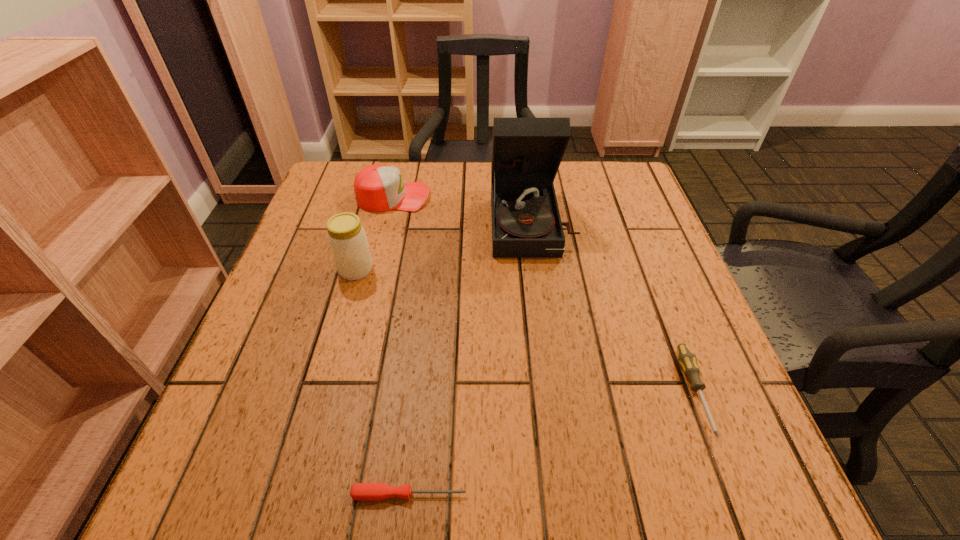
You are a GUI agent. You are given a task and a screenshot of the screen. Output one action in this format:
    pyautogui.click(x=<x>, y=<y>)
    Task: Click on the blank region between the fourth object from left to right and the rightmost object
    This screenshot has height=540, width=960.
    Given the screenshot: What is the action you would take?
    pyautogui.click(x=613, y=307)

At what (x,y) coordinates should I click in order to perform the action: click on free space that is in between the nearer screwdriver and the taller screwdriver. Please return your answer as a coordinate pair (x, y). This screenshot has width=960, height=540. Looking at the image, I should click on (552, 443).

Find the location of a particular element. blank region between the shorter screwdriver and the second tallest object is located at coordinates (383, 382).

Identify the location of free spot between the baseball cap and the second object from right to left. (463, 210).

This screenshot has height=540, width=960. I want to click on vacant area between the shortest object and the third farthest object, so click(x=383, y=382).

You are a GUI agent. You are given a task and a screenshot of the screen. Output one action in this format:
    pyautogui.click(x=<x>, y=<y>)
    Task: Click on the free space between the baseball cap and the fourth object from left to right
    Image resolution: width=960 pixels, height=540 pixels.
    Given the screenshot: What is the action you would take?
    pyautogui.click(x=463, y=210)

Identify the location of free spot between the phonograph_record and the third nearest object. (444, 246).

At what (x,y) coordinates should I click in order to perform the action: click on object that can be found as the fourth closest to the taller screwdriver. Please return your answer as a coordinate pair (x, y). The height and width of the screenshot is (540, 960). Looking at the image, I should click on (378, 188).

Identify which object is located as the fourth nearest to the left screwdriver. Please provide its 2D coordinates. Your answer should be formatted as a tuple, i.e. [(x, y)], where the tuple contains the x and y coordinates of a point satisfying the conditions above.

[(378, 188)]

Image resolution: width=960 pixels, height=540 pixels. I want to click on vacant space that satisfies the following two spatial constraints: 1. on the front-facing side of the third tallest object; 2. on the front side of the fourth shortest object, so click(x=375, y=270).